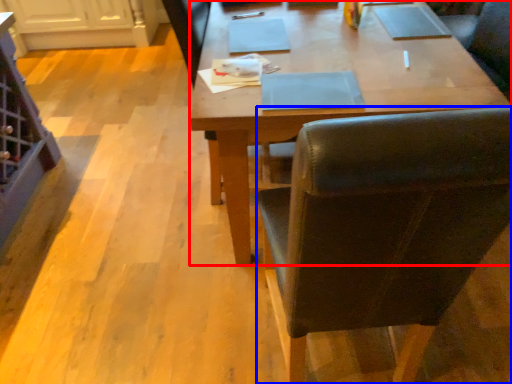
Question: Among these objects, which one is farthest to the camera, desk (highlighted by a red box) or chair (highlighted by a blue box)?

Choices:
 (A) desk
 (B) chair

Answer: (A)